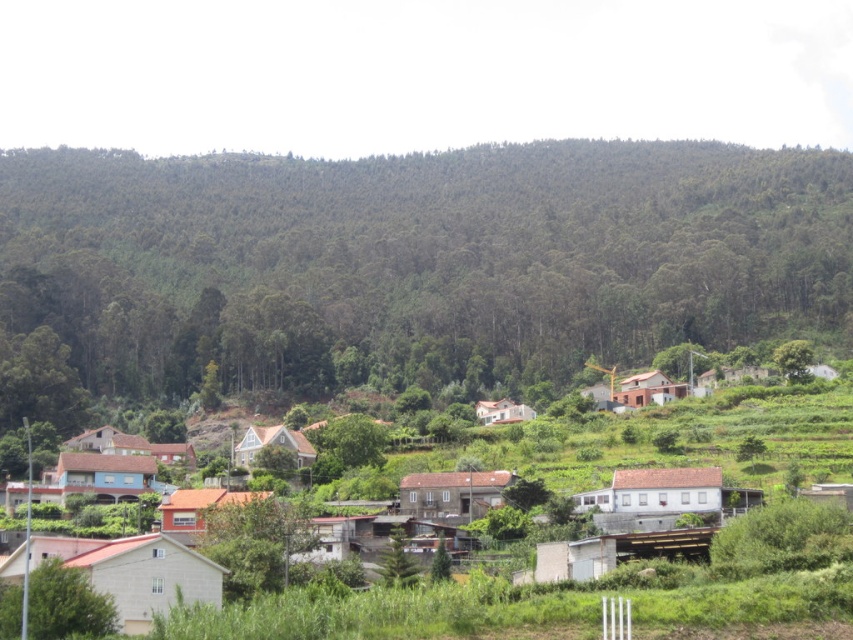
You are a visitor standing in the grassy area in front of the village. You see the blue painted wooden house at lower left and the light brown wooden house at lower left. Which one is closer to you?

The blue painted wooden house at lower left is closer to you because it is positioned over the light brown wooden house at lower left, indicating it is in front.

You are standing at the center of the village and want to visit the blue painted wooden house at lower left. According to the map coordinates provided, which direction should you head to reach it?

The blue painted wooden house at lower left is located at point (x=105, y=476), so you should head towards the lower left direction from the center of the village to reach it.